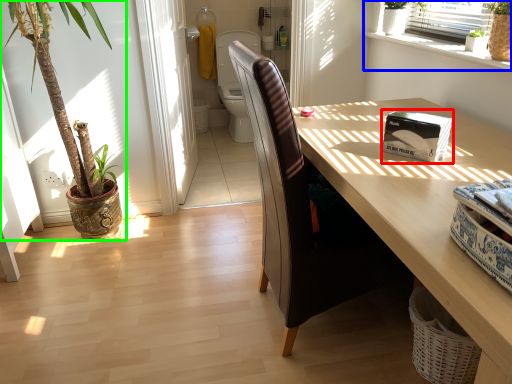
Question: Based on their relative distances, which object is farther from box (highlighted by a red box)? Choose from window (highlighted by a blue box) and houseplant (highlighted by a green box).

Choices:
 (A) window
 (B) houseplant

Answer: (B)